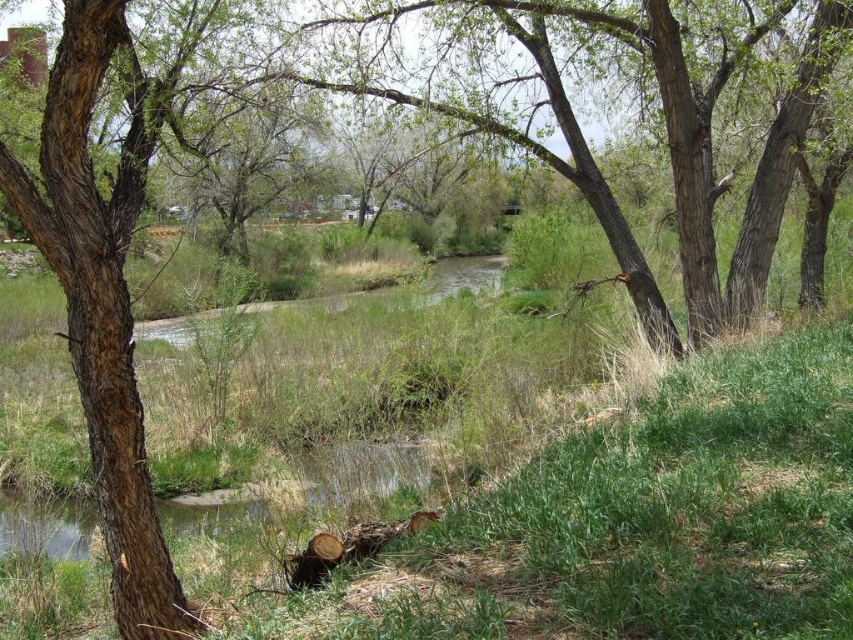
Question: Is brown rough bark tree trunk at left smaller than brown rough tree at center?

Choices:
 (A) yes
 (B) no

Answer: (B)

Question: Which of these objects is positioned farthest from the brown rough tree at center?

Choices:
 (A) green grass at center
 (B) brown rough bark tree trunk at left

Answer: (B)

Question: Does green grass at center appear on the right side of brown rough tree at center?

Choices:
 (A) yes
 (B) no

Answer: (B)

Question: Does green grass at center appear over brown rough bark tree trunk at left?

Choices:
 (A) no
 (B) yes

Answer: (A)

Question: Which point appears closest to the camera in this image?

Choices:
 (A) pyautogui.click(x=741, y=352)
 (B) pyautogui.click(x=672, y=67)

Answer: (A)

Question: Which of the following is the closest to the observer?

Choices:
 (A) (22, 502)
 (B) (136, 120)

Answer: (A)